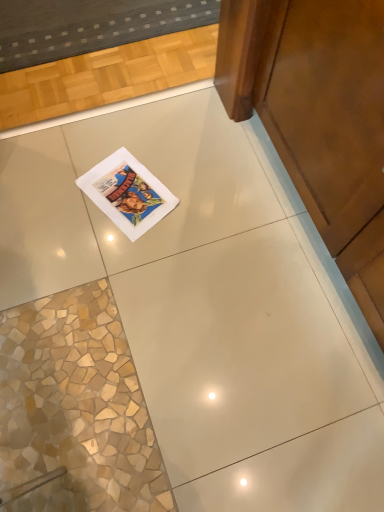
Where is `unoccupied region to the right of matte paper magazine at center`? unoccupied region to the right of matte paper magazine at center is located at coordinates (201, 198).